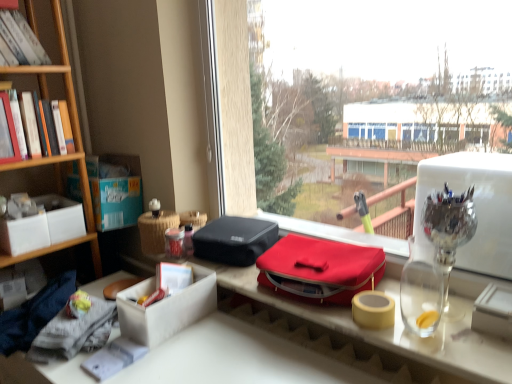
What is the approximate height of white matte box at left?

white matte box at left is 13.65 centimeters in height.

What do you see at coordinates (373, 310) in the screenshot?
I see `yellow matte adhesive tape at right` at bounding box center [373, 310].

Where is `yellow matte adhesive tape at right`? This screenshot has height=384, width=512. yellow matte adhesive tape at right is located at coordinates (373, 310).

Where is `transparent glass pen holder at upper right`? The height and width of the screenshot is (384, 512). transparent glass pen holder at upper right is located at coordinates (449, 232).

Locate an element on the screen. Image resolution: width=512 pixels, height=384 pixels. matte red lunch box at center is located at coordinates (320, 269).

Measure the distance between transparent glass window at center and camera.

7.13 feet.

Find the location of a particular element. transparent glass window at center is located at coordinates (403, 137).

The image size is (512, 384). What do you see at coordinates (115, 191) in the screenshot?
I see `cardboard box at left` at bounding box center [115, 191].

Locate an element on the screen. The image size is (512, 384). hardcover book at left is located at coordinates (45, 158).

From a real-world perspective, who is located higher, hardcover book at left or transparent glass pen holder at upper right?

In real-world perspective, hardcover book at left is above.

Is hardcover book at left to the left of transparent glass pen holder at upper right from the viewer's perspective?

Correct, you'll find hardcover book at left to the left of transparent glass pen holder at upper right.

Is hardcover book at left in contact with transparent glass pen holder at upper right?

No, hardcover book at left is not next to transparent glass pen holder at upper right.

Is point (41, 160) closer to camera compared to point (426, 222)?

No, it is behind (426, 222).

Is transparent glass pen holder at upper right further to the viewer compared to hardcover book at left?

No, it is in front of hardcover book at left.

Based on their sizes in the image, would you say transparent glass pen holder at upper right is bigger or smaller than hardcover book at left?

transparent glass pen holder at upper right is bigger than hardcover book at left.

Can you confirm if transparent glass pen holder at upper right is taller than hardcover book at left?

Yes.

Which is correct: transparent glass pen holder at upper right is inside hardcover book at left, or outside of it?

transparent glass pen holder at upper right is located beyond the bounds of hardcover book at left.

Can you tell me how much white cardboard box at center and transparent glass window at center differ in facing direction?

They differ by 0.0278 degrees in their facing directions.

Is white cardboard box at center behind transparent glass window at center?

That is False.

Is white cardboard box at center at the right side of transparent glass window at center?

No.

From a real-world perspective, is white cardboard box at center under transparent glass window at center?

Yes.

Is yellow matte adhesive tape at right outside of hardcover book at left?

yellow matte adhesive tape at right is positioned outside hardcover book at left.

Considering the relative positions of yellow matte adhesive tape at right and hardcover book at left in the image provided, is yellow matte adhesive tape at right to the left of hardcover book at left from the viewer's perspective?

In fact, yellow matte adhesive tape at right is to the right of hardcover book at left.

Does yellow matte adhesive tape at right touch hardcover book at left?

yellow matte adhesive tape at right and hardcover book at left are not in contact.

From the image's perspective, who appears lower, yellow matte adhesive tape at right or hardcover book at left?

yellow matte adhesive tape at right is shown below in the image.

Is transparent glass window at center further to the viewer compared to white matte box at left?

No, it is in front of white matte box at left.

Is transparent glass window at center taller than white matte box at left?

Yes.

Considering the sizes of objects transparent glass window at center and white matte box at left in the image provided, who is smaller, transparent glass window at center or white matte box at left?

Smaller between the two is white matte box at left.

Who is taller, transparent glass pen holder at upper right or white cardboard box at center?

transparent glass pen holder at upper right is taller.

Based on their sizes in the image, would you say transparent glass pen holder at upper right is bigger or smaller than white cardboard box at center?

Considering their sizes, transparent glass pen holder at upper right takes up less space than white cardboard box at center.

From a real-world perspective, between transparent glass pen holder at upper right and white cardboard box at center, who is vertically lower?

From a 3D spatial view, white cardboard box at center is below.

Is transparent glass pen holder at upper right completely or partially outside of white cardboard box at center?

Indeed, transparent glass pen holder at upper right is completely outside white cardboard box at center.

Considering the sizes of objects white cardboard box at center and yellow matte adhesive tape at right in the image provided, who is bigger, white cardboard box at center or yellow matte adhesive tape at right?

With larger size is white cardboard box at center.

Which object is further away from the camera taking this photo, white cardboard box at center or yellow matte adhesive tape at right?

yellow matte adhesive tape at right is behind.

Does white cardboard box at center turn towards yellow matte adhesive tape at right?

No.

Considering the relative positions of white cardboard box at center and yellow matte adhesive tape at right in the image provided, is white cardboard box at center to the left or to the right of yellow matte adhesive tape at right?

Clearly, white cardboard box at center is on the left of yellow matte adhesive tape at right in the image.

This screenshot has height=384, width=512. Find the location of `book on the left of transparent glass pen holder at upper right`. book on the left of transparent glass pen holder at upper right is located at coordinates (45, 158).

At what (x,y) coordinates should I click in order to perform the action: click on glass vase on the right side of hardcover book at left. Please return your answer as a coordinate pair (x, y). Looking at the image, I should click on (449, 232).

Consider the image. Considering their positions, is matte red lunch box at center positioned closer to white matte box at left than transparent glass pen holder at upper right?

matte red lunch box at center lies closer to white matte box at left than the other object.

Based on the photo, looking at the image, which one is located closer to white matte box at left, cardboard box at left or white cardboard box at center?

Among the two, cardboard box at left is located nearer to white matte box at left.

Estimate the real-world distances between objects in this image. Which object is closer to yellow matte adhesive tape at right, hardcover book at left or transparent glass window at center?

hardcover book at left.

From the image, which object appears to be nearer to yellow matte adhesive tape at right, transparent glass window at center or white cardboard box at center?

white cardboard box at center is closer to yellow matte adhesive tape at right.

When comparing their distances from white matte box at left, does hardcover book at left or transparent glass pen holder at upper right seem further?

Based on the image, transparent glass pen holder at upper right appears to be further to white matte box at left.

Based on their spatial positions, is matte red lunch box at center or white matte box at left further from white cardboard box at center?

Among the two, white matte box at left is located further to white cardboard box at center.

Estimate the real-world distances between objects in this image. Which object is closer to transparent glass window at center, cardboard box at left or yellow matte adhesive tape at right?

cardboard box at left lies closer to transparent glass window at center than the other object.

From the image, which object appears to be farther from white matte box at left, white cardboard box at center or transparent glass pen holder at upper right?

Among the two, transparent glass pen holder at upper right is located further to white matte box at left.

Where is `table between hardcover book at left and transparent glass window at center in the horizontal direction`? The image size is (512, 384). table between hardcover book at left and transparent glass window at center in the horizontal direction is located at coordinates (397, 324).

At what (x,y) coordinates should I click in order to perform the action: click on window situated between hardcover book at left and transparent glass pen holder at upper right from left to right. Please return your answer as a coordinate pair (x, y). The image size is (512, 384). Looking at the image, I should click on (403, 137).

Locate an element on the screen. The height and width of the screenshot is (384, 512). lunch box situated between white matte box at left and transparent glass window at center from left to right is located at coordinates (320, 269).

Identify the location of table located between white matte box at left and transparent glass window at center in the left-right direction. (397, 324).